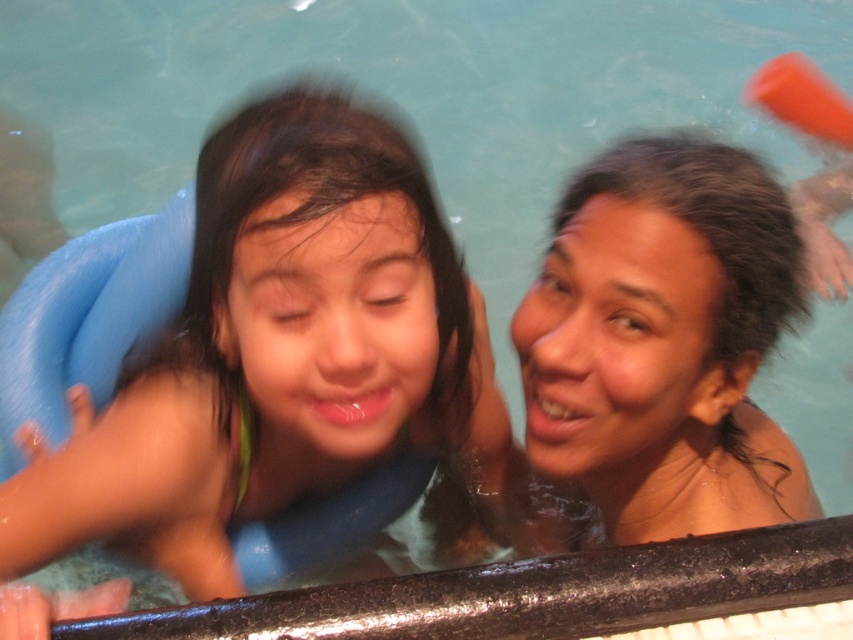
You are a lifeguard who needs to determine if the smooth blue float at left and the smooth skin woman at upper right are within a safe distance according to the pool safety guidelines that require at least 12 inches between any floating objects and swimmers. Are they within the required distance?

The smooth blue float at left and the smooth skin woman at upper right are 14.49 inches apart, which is more than the required 12 inches, so they are within the safe distance according to the guidelines.

You are standing at the edge of the pool and see the smooth blue float at left. If you want to reach it without entering the water, which direction should you move towards?

The smooth blue float at left is located at point 0.566 on the x and 0.309 on the y coordinates, so you should move towards the left side of the pool to reach it without entering the water.

You are a lifeguard on duty and notice the smooth blue float at left and the smooth skin woman at upper right in the pool. Which object is larger in size?

The smooth blue float at left is bigger than the smooth skin woman at upper right according to the description.